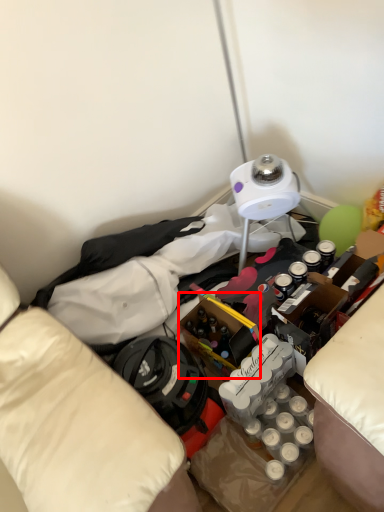
Question: From the image's perspective, what is the correct spatial relationship of wine bottle (annotated by the red box) in relation to clothing?

Choices:
 (A) below
 (B) above

Answer: (A)